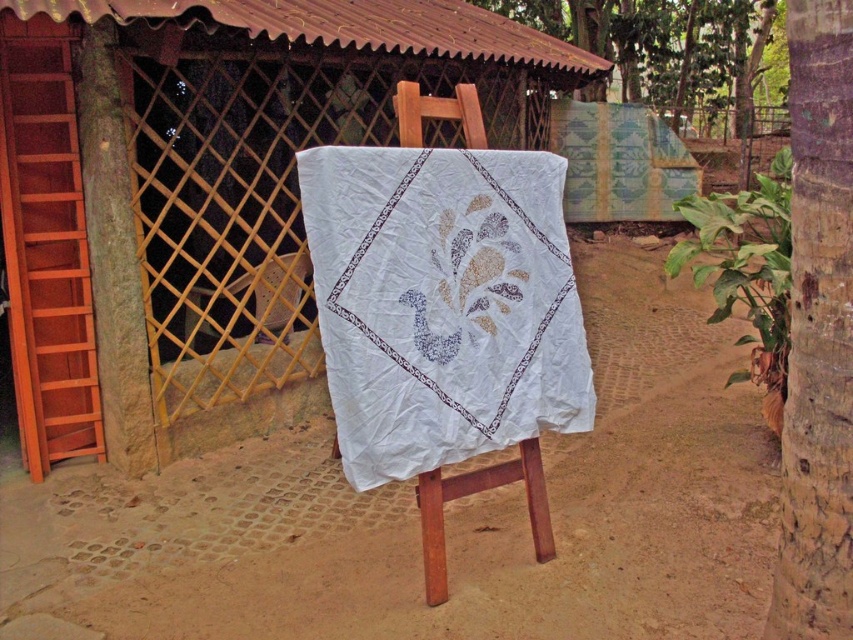
Question: Which point is farther to the camera?

Choices:
 (A) pos(697,83)
 (B) pos(849,618)

Answer: (A)

Question: Which point appears farthest from the camera in this image?

Choices:
 (A) (508, 266)
 (B) (305, 572)

Answer: (B)

Question: Does white fabric at center have a lesser width compared to green leafy tree at upper right?

Choices:
 (A) no
 (B) yes

Answer: (A)

Question: Is wooden stool at center bigger than wooden lattice at center?

Choices:
 (A) no
 (B) yes

Answer: (A)

Question: In this image, where is brown rough bark tree at right located relative to wooden lattice at center?

Choices:
 (A) above
 (B) below

Answer: (B)

Question: Estimate the real-world distances between objects in this image. Which object is closer to the white cotton quilt at center?

Choices:
 (A) dirt field at center
 (B) brown rough bark tree at right
 (C) wooden lattice at center
 (D) green leafy tree at upper right

Answer: (A)